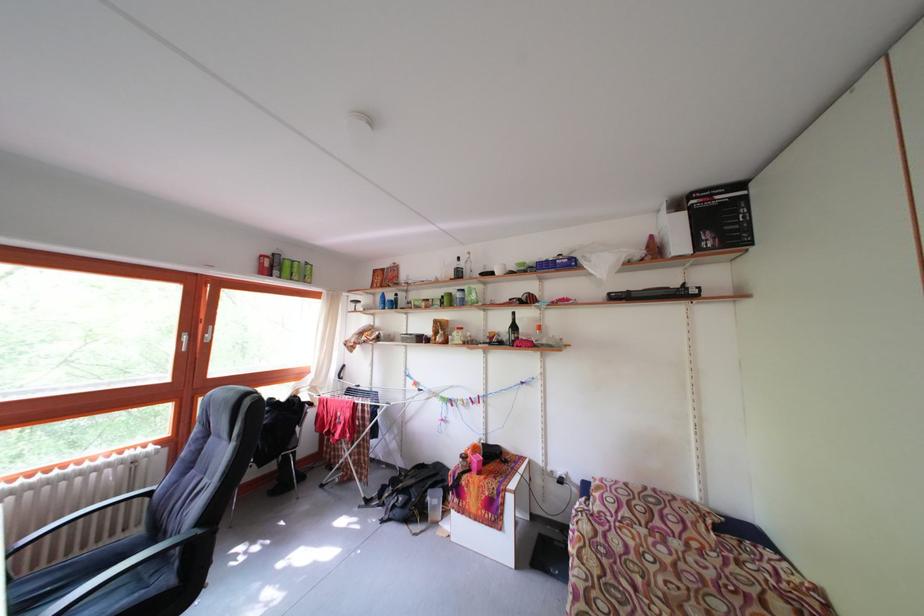
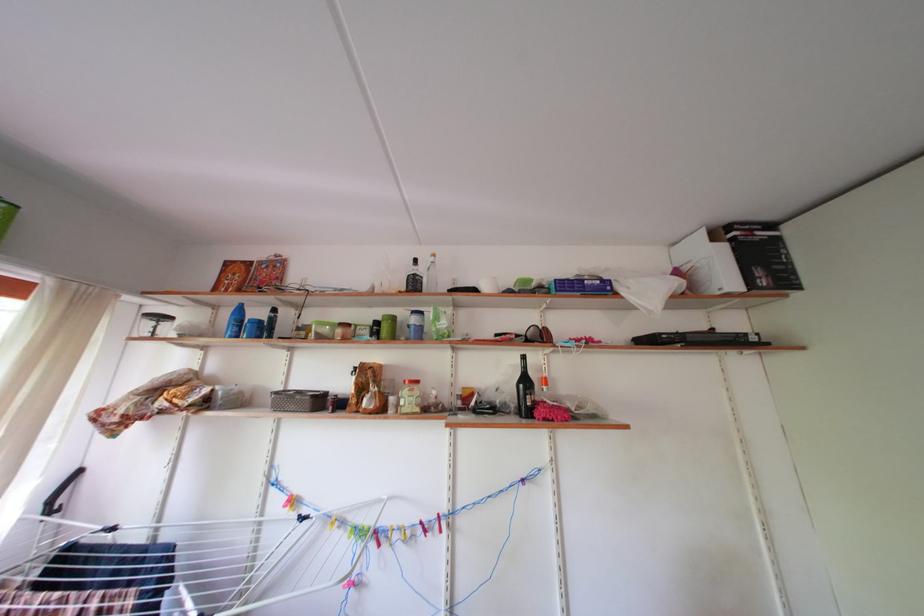
Find the pixel in the second image that matches (x=713, y=243) in the first image.

(768, 278)